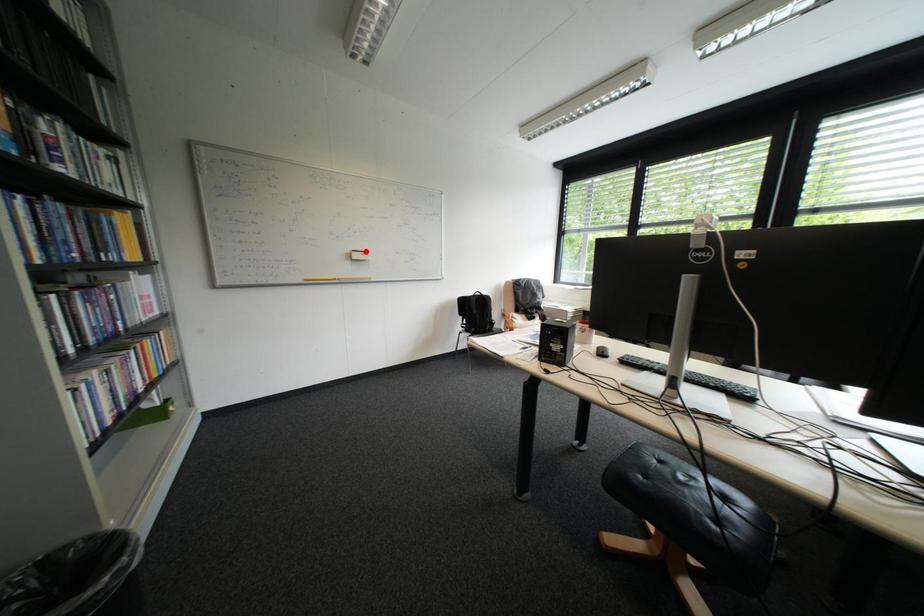
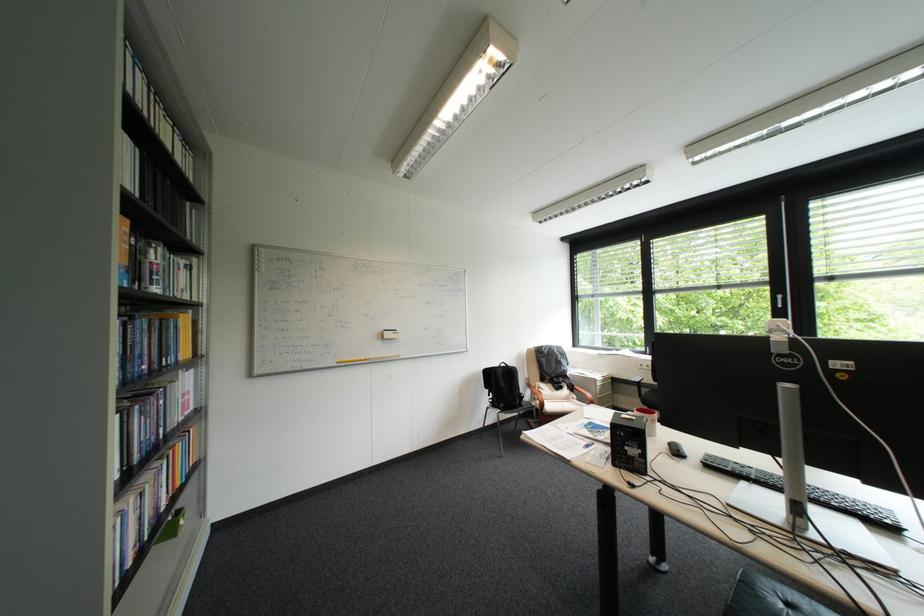
Where in the second image is the point corresponding to the highlighted location from the first image?

(397, 331)